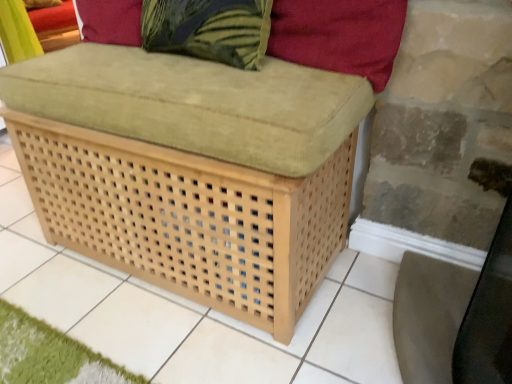
Question: Considering the positions of velvet red pillow at upper right and matte beige swivel chair at lower right in the image, is velvet red pillow at upper right bigger or smaller than matte beige swivel chair at lower right?

Choices:
 (A) small
 (B) big

Answer: (A)

Question: Is point (350, 29) closer or farther from the camera than point (496, 332)?

Choices:
 (A) farther
 (B) closer

Answer: (A)

Question: Estimate the real-world distances between objects in this image. Which object is closer to the matte beige swivel chair at lower right?

Choices:
 (A) velvet red pillow at upper right
 (B) light brown woven ottoman at center
 (C) green textured pillow at upper center

Answer: (A)

Question: Which of these objects is positioned closest to the light brown woven ottoman at center?

Choices:
 (A) green textured pillow at upper center
 (B) matte beige swivel chair at lower right
 (C) velvet red pillow at upper right

Answer: (A)